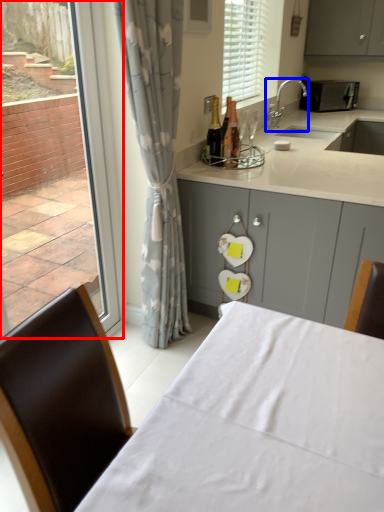
Question: Which point is closer to the camera, window (highlighted by a red box) or tap (highlighted by a blue box)?

Choices:
 (A) window
 (B) tap

Answer: (A)